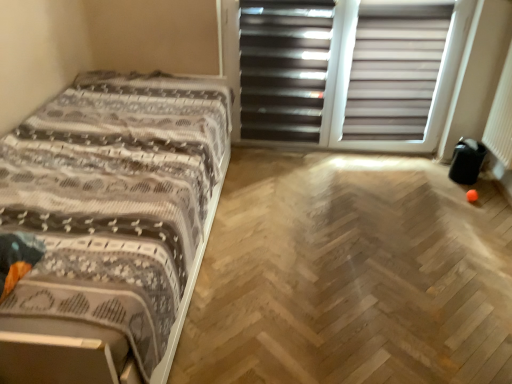
Question: Could you tell me if matte white blinds at upper right is turned towards black matte screen door at upper center, which ranks as the 2th screen door in right-to-left order?

Choices:
 (A) yes
 (B) no

Answer: (B)

Question: From a real-world perspective, is matte white blinds at upper right physically below black matte screen door at upper center, which ranks as the 2th screen door in right-to-left order?

Choices:
 (A) yes
 (B) no

Answer: (B)

Question: Does matte white blinds at upper right appear on the right side of black matte screen door at upper center, which ranks as the 2th screen door in right-to-left order?

Choices:
 (A) no
 (B) yes

Answer: (B)

Question: Is black matte screen door at upper center, which ranks as the 2th screen door in right-to-left order, surrounded by matte white blinds at upper right?

Choices:
 (A) yes
 (B) no

Answer: (B)

Question: Can you see matte white blinds at upper right touching black matte screen door at upper center, the 1th screen door positioned from the left?

Choices:
 (A) yes
 (B) no

Answer: (B)

Question: In terms of height, does black matte screen door at upper center, which ranks as the 2th screen door in right-to-left order, look taller or shorter compared to matte white blinds at upper right?

Choices:
 (A) short
 (B) tall

Answer: (B)

Question: Considering the positions of black matte screen door at upper center, the 1th screen door positioned from the left, and matte white blinds at upper right in the image, is black matte screen door at upper center, the 1th screen door positioned from the left, wider or thinner than matte white blinds at upper right?

Choices:
 (A) wide
 (B) thin

Answer: (B)

Question: Looking at the image, does black matte screen door at upper center, the 1th screen door positioned from the left, seem bigger or smaller compared to matte white blinds at upper right?

Choices:
 (A) big
 (B) small

Answer: (B)

Question: Based on their positions, is black matte screen door at upper center, which ranks as the 2th screen door in right-to-left order, located to the left or right of matte white blinds at upper right?

Choices:
 (A) right
 (B) left

Answer: (B)

Question: Is white plastic blinds at upper center, arranged as the first screen door when viewed from the right, to the left or to the right of patterned fabric bed at left in the image?

Choices:
 (A) right
 (B) left

Answer: (A)

Question: From the image's perspective, is white plastic blinds at upper center, the 2th screen door when ordered from left to right, positioned above or below patterned fabric bed at left?

Choices:
 (A) above
 (B) below

Answer: (A)

Question: From a real-world perspective, is white plastic blinds at upper center, arranged as the first screen door when viewed from the right, physically located above or below patterned fabric bed at left?

Choices:
 (A) above
 (B) below

Answer: (A)

Question: From their relative heights in the image, would you say white plastic blinds at upper center, the 2th screen door when ordered from left to right, is taller or shorter than patterned fabric bed at left?

Choices:
 (A) short
 (B) tall

Answer: (B)

Question: Visually, is matte white blinds at upper right positioned to the left or to the right of black matte screen door at upper center, which ranks as the 2th screen door in right-to-left order?

Choices:
 (A) left
 (B) right

Answer: (B)

Question: Considering the positions of matte white blinds at upper right and black matte screen door at upper center, the 1th screen door positioned from the left, in the image, is matte white blinds at upper right bigger or smaller than black matte screen door at upper center, the 1th screen door positioned from the left,?

Choices:
 (A) small
 (B) big

Answer: (B)